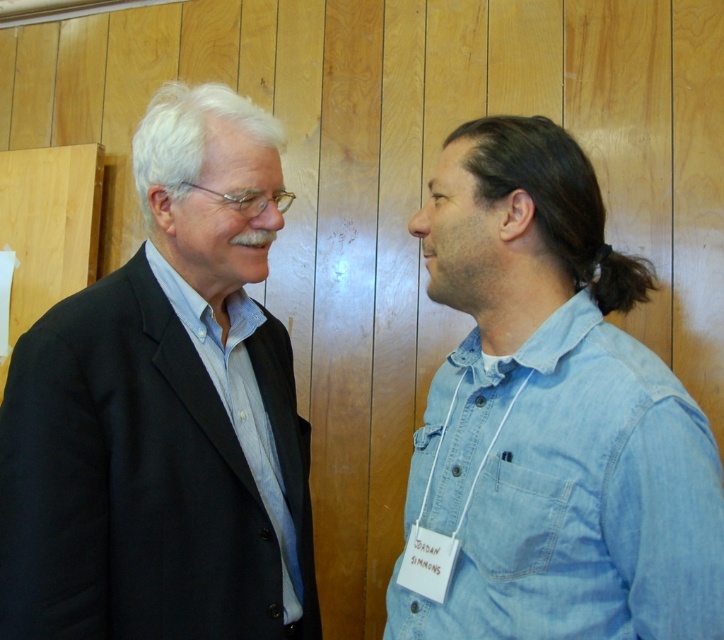
Question: Is the position of black matte suit at left more distant than that of denim shirt at right?

Choices:
 (A) no
 (B) yes

Answer: (B)

Question: Which point is closer to the camera taking this photo?

Choices:
 (A) (159, 324)
 (B) (424, 212)

Answer: (A)

Question: Which point is closer to the camera?

Choices:
 (A) (513, 144)
 (B) (117, 433)

Answer: (B)

Question: Can you confirm if black matte suit at left is wider than denim shirt at right?

Choices:
 (A) yes
 (B) no

Answer: (A)

Question: Is black matte suit at left above denim shirt at right?

Choices:
 (A) no
 (B) yes

Answer: (A)